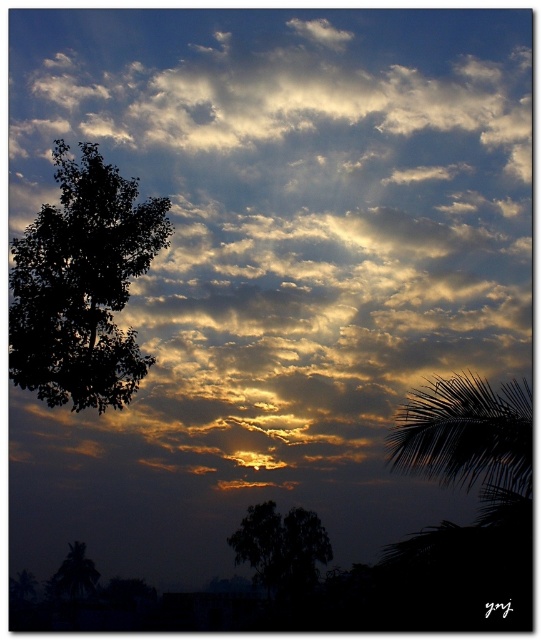
Question: Is dark green leafy tree at left positioned before dark green leafy tree at center?

Choices:
 (A) yes
 (B) no

Answer: (A)

Question: Does dark green leafy tree at left appear over dark green leafy tree at center?

Choices:
 (A) no
 (B) yes

Answer: (B)

Question: In this image, where is dark green leafy tree at left located relative to dark green leafy tree at center?

Choices:
 (A) left
 (B) right

Answer: (A)

Question: Among these points, which one is farthest from the camera?

Choices:
 (A) (123, 276)
 (B) (306, 524)

Answer: (B)

Question: Among these points, which one is nearest to the camera?

Choices:
 (A) (68, 349)
 (B) (282, 573)

Answer: (A)

Question: Among these objects, which one is nearest to the camera?

Choices:
 (A) dark green leafy tree at left
 (B) dark green leafy tree at center

Answer: (A)